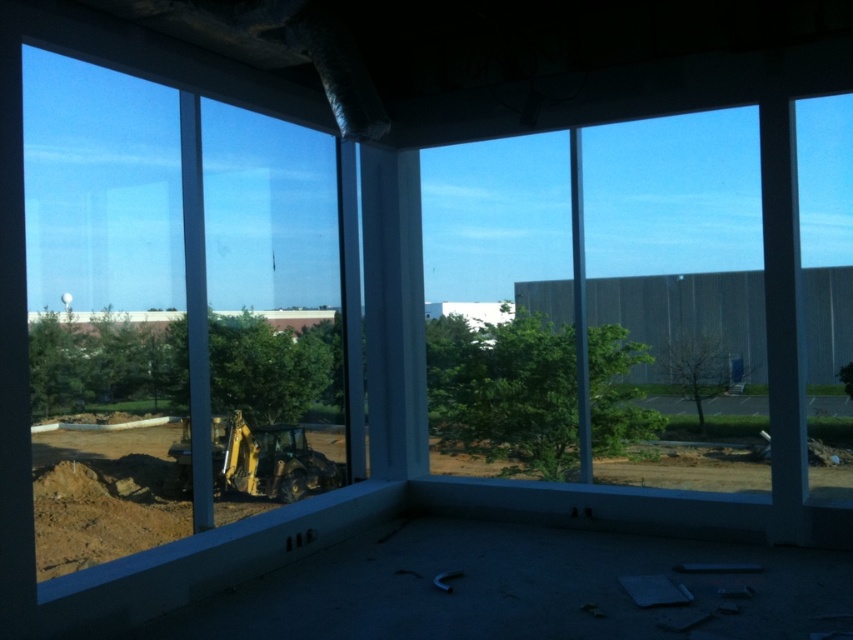
Question: Which point appears farthest from the camera in this image?

Choices:
 (A) (192, 289)
 (B) (492, 144)
 (C) (180, 467)

Answer: (B)

Question: Is transparent glass window at center below yellow rubber excavator at lower left?

Choices:
 (A) no
 (B) yes

Answer: (A)

Question: Which point is closer to the camera?

Choices:
 (A) clear glass window at left
 (B) yellow rubber excavator at lower left
 (C) transparent glass window at center

Answer: (A)

Question: Which of the following is the closest to the observer?

Choices:
 (A) clear glass window at left
 (B) transparent glass window at center

Answer: (A)

Question: Observing the image, what is the correct spatial positioning of transparent glass window at center in reference to yellow rubber excavator at lower left?

Choices:
 (A) left
 (B) right

Answer: (B)

Question: Is transparent glass window at center to the left of yellow rubber excavator at lower left from the viewer's perspective?

Choices:
 (A) yes
 (B) no

Answer: (B)